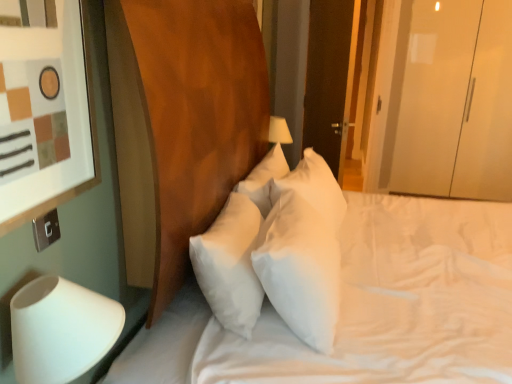
Question: From a real-world perspective, is transparent glossy wardrobe at right above or below white soft pillow at center?

Choices:
 (A) below
 (B) above

Answer: (B)

Question: From the image's perspective, relative to white soft pillow at center, is transparent glossy wardrobe at right above or below?

Choices:
 (A) below
 (B) above

Answer: (B)

Question: Estimate the real-world distances between objects in this image. Which object is farther from the matte white picture frame at left?

Choices:
 (A) transparent glossy wardrobe at right
 (B) white matte table lamp at lower left
 (C) silver metallic switch at lower left
 (D) dark wood door at upper right
 (E) white soft mattress at center

Answer: (A)

Question: Which of these objects is positioned closest to the white matte table lamp at lower left?

Choices:
 (A) transparent glossy wardrobe at right
 (B) white soft mattress at center
 (C) white soft pillow at center
 (D) dark wood door at upper right
 (E) silver metallic switch at lower left

Answer: (E)